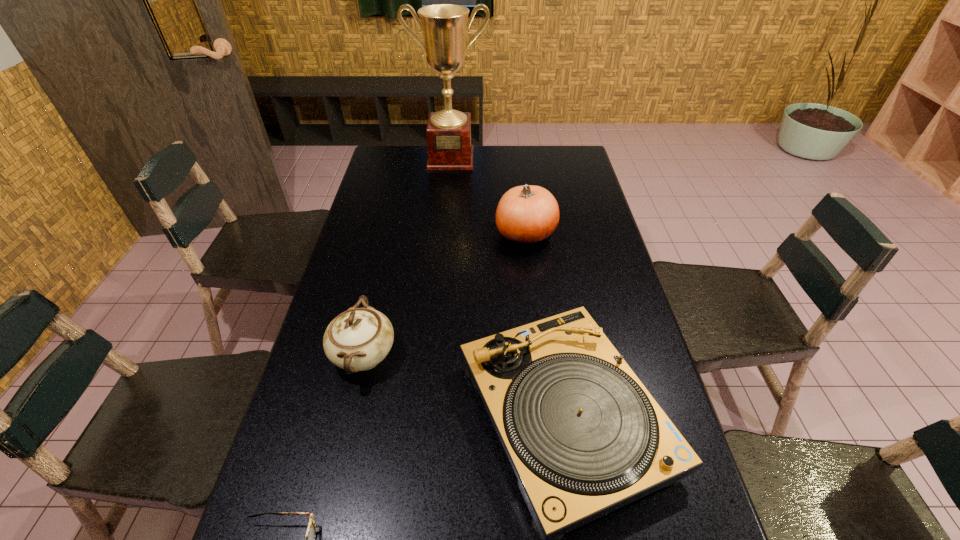
Where is `trophy cup`? The width and height of the screenshot is (960, 540). trophy cup is located at coordinates (448, 134).

Locate an element on the screen. the farthest object is located at coordinates (448, 134).

This screenshot has height=540, width=960. Find the location of `pumpkin`. pumpkin is located at coordinates (527, 214).

This screenshot has width=960, height=540. Find the location of `chinaware`. chinaware is located at coordinates (358, 339).

What are the coordinates of `blank area located on the plaque of the tallest object` in the screenshot? It's located at (446, 207).

The image size is (960, 540). Identify the location of free location located 0.090m on the right of the pumpkin. pyautogui.click(x=583, y=233).

This screenshot has height=540, width=960. Identify the location of free space located on the right of the chinaware. (501, 356).

Where is `object at the far edge`? The height and width of the screenshot is (540, 960). object at the far edge is located at coordinates (448, 134).

Where is `trophy cup at the left edge`? trophy cup at the left edge is located at coordinates (448, 134).

Where is `chinaware situated at the left edge`? chinaware situated at the left edge is located at coordinates (358, 339).